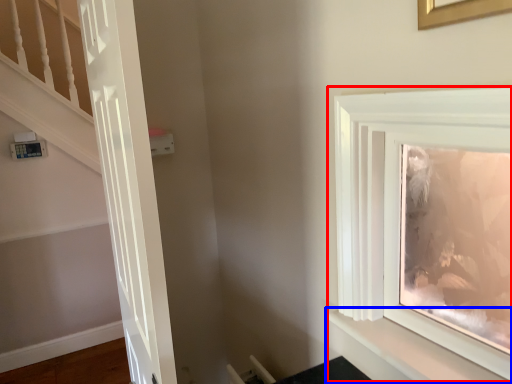
Question: Which object is closer to the camera taking this photo, window (highlighted by a red box) or shelf (highlighted by a blue box)?

Choices:
 (A) window
 (B) shelf

Answer: (A)